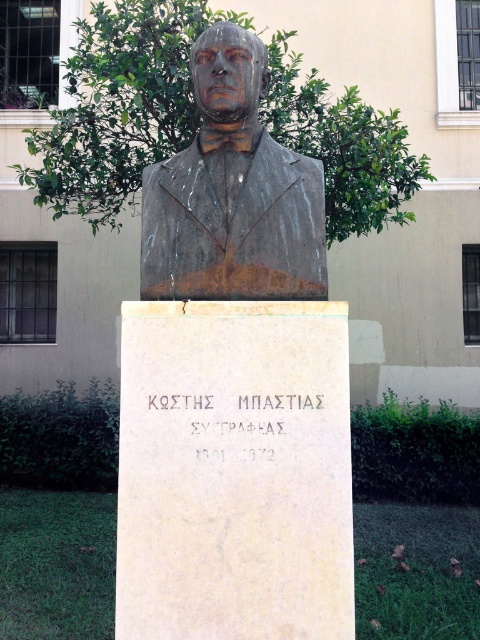
Can you confirm if green leafy tree at upper center is positioned above bronze statue at center?

Yes, green leafy tree at upper center is above bronze statue at center.

This screenshot has width=480, height=640. What do you see at coordinates (120, 106) in the screenshot? I see `green leafy tree at upper center` at bounding box center [120, 106].

Where is `green leafy tree at upper center`? The width and height of the screenshot is (480, 640). green leafy tree at upper center is located at coordinates (120, 106).